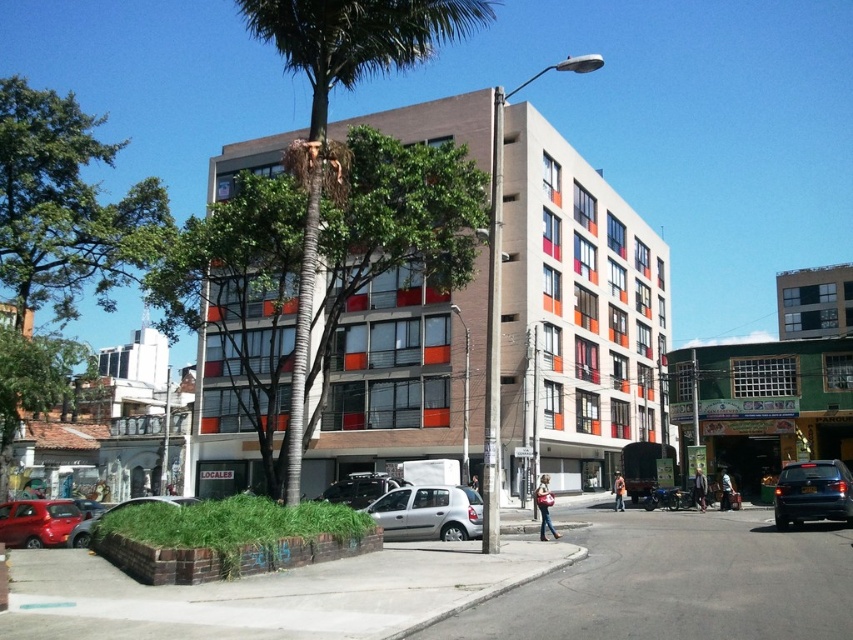
Question: Is green leafy tree at left smaller than white glass windows at upper right?

Choices:
 (A) yes
 (B) no

Answer: (B)

Question: Estimate the real-world distances between objects in this image. Which object is farther from the silver metallic car at center?

Choices:
 (A) silver metallic hatchback at center
 (B) satin black car at lower right
 (C) matte red car at lower left

Answer: (B)

Question: Is satin black car at lower right above metallic silver car at lower left?

Choices:
 (A) yes
 (B) no

Answer: (A)

Question: Which point appears farthest from the camera in this image?

Choices:
 (A) (676, 358)
 (B) (61, 531)

Answer: (A)

Question: Is white glass windows at upper right above matte red car at lower left?

Choices:
 (A) no
 (B) yes

Answer: (B)

Question: Which object is positioned farthest from the green painted building at lower right?

Choices:
 (A) matte concrete building at center
 (B) satin black car at lower right
 (C) metallic silver car at lower left
 (D) green leafy tree at left

Answer: (D)